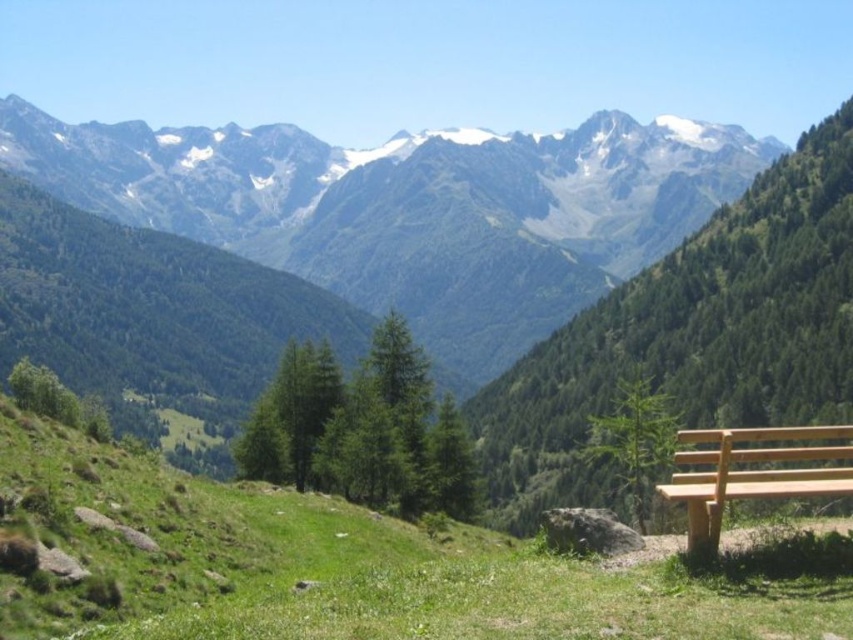
You are a hiker who wants to take a photo of the green textured mountains at upper center while sitting on the light brown wood bench at lower right. Is the bench positioned in a way that allows you to see the mountains without obstruction?

The green textured mountains at upper center is positioned over the light brown wood bench at lower right, so when sitting on the bench, the mountains will be directly above you, allowing you to see them without obstruction.